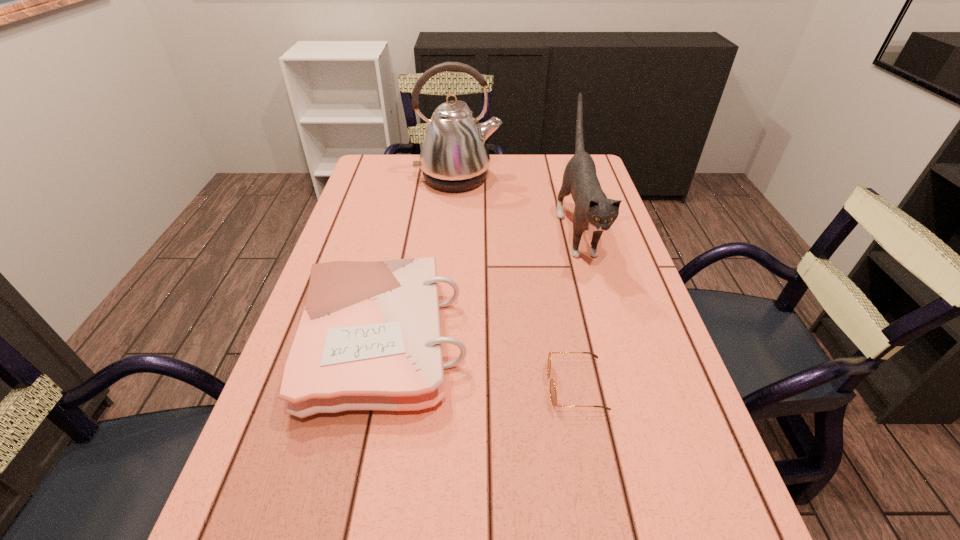
Locate an element on the screen. blank area in the image that satisfies the following two spatial constraints: 1. at the face of the cat; 2. on the lenses of the sunglasses is located at coordinates (621, 386).

Where is `vacant space that satisfies the following two spatial constraints: 1. at the face of the cat; 2. on the lenses of the shortest object`? The height and width of the screenshot is (540, 960). vacant space that satisfies the following two spatial constraints: 1. at the face of the cat; 2. on the lenses of the shortest object is located at coordinates (621, 386).